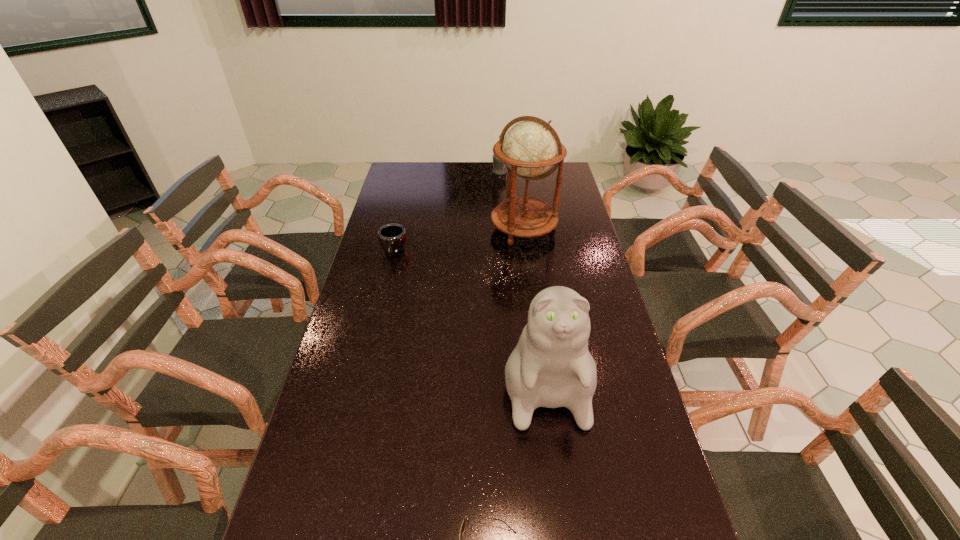
Find the location of a particular element. The width and height of the screenshot is (960, 540). vacant area situated on the front label of the third tallest object is located at coordinates (408, 172).

Locate an element on the screen. This screenshot has width=960, height=540. vacant area situated 0.350m on the front label of the third tallest object is located at coordinates (419, 172).

The height and width of the screenshot is (540, 960). Find the location of `vacant region located on the side of the fourth tallest object with the handle`. vacant region located on the side of the fourth tallest object with the handle is located at coordinates (378, 316).

You are a GUI agent. You are given a task and a screenshot of the screen. Output one action in this format:
    pyautogui.click(x=<x>, y=<y>)
    Task: Click on the object at the far edge
    This screenshot has height=540, width=960.
    Given the screenshot: What is the action you would take?
    pyautogui.click(x=499, y=168)

The image size is (960, 540). I want to click on object located at the left edge, so coord(392,237).

This screenshot has height=540, width=960. Find the location of `globe that is at the right edge`. globe that is at the right edge is located at coordinates (529, 149).

Locate an element on the screen. The width and height of the screenshot is (960, 540). cat that is at the right edge is located at coordinates (551, 367).

In the image, there is a desktop. Where is `vacant space at the far edge`? The image size is (960, 540). vacant space at the far edge is located at coordinates (492, 174).

The height and width of the screenshot is (540, 960). Identify the location of vacant space at the left edge of the desktop. (384, 279).

This screenshot has height=540, width=960. In the image, there is a desktop. Identify the location of free region at the right edge. (567, 241).